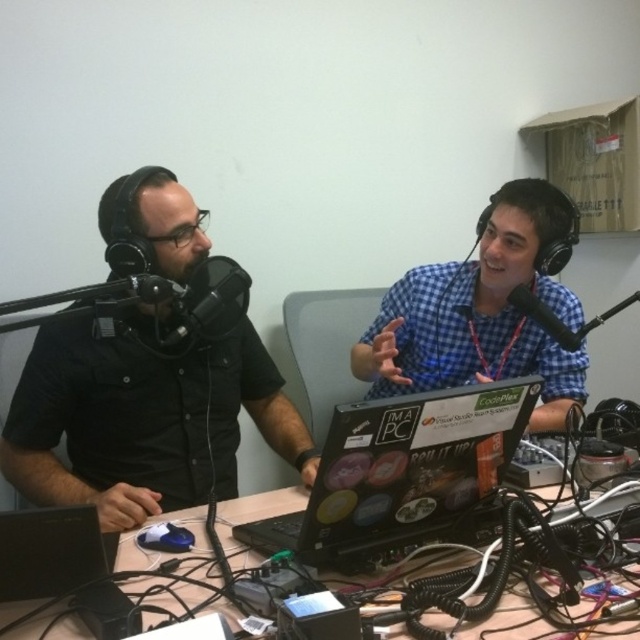
Question: Which of the following is the closest to the observer?

Choices:
 (A) (157, 595)
 (B) (518, 308)
 (C) (468, 474)

Answer: (A)

Question: In this image, where is black matte shirt at left located relative to black matte microphone at right?

Choices:
 (A) below
 (B) above

Answer: (A)

Question: Can you confirm if black matte shirt at left is thinner than blue checkered shirt at center?

Choices:
 (A) yes
 (B) no

Answer: (B)

Question: Which point appears farthest from the camera in this image?

Choices:
 (A) (513, 237)
 (B) (445, 429)
 (C) (552, 314)
 (D) (134, 486)

Answer: (C)

Question: Which point is closer to the camera?

Choices:
 (A) black matte microphone at right
 (B) blue checkered shirt at center
 (C) shiny black laptop at center

Answer: (C)

Question: Is black matte shirt at left to the left of blue checkered shirt at center from the viewer's perspective?

Choices:
 (A) no
 (B) yes

Answer: (B)